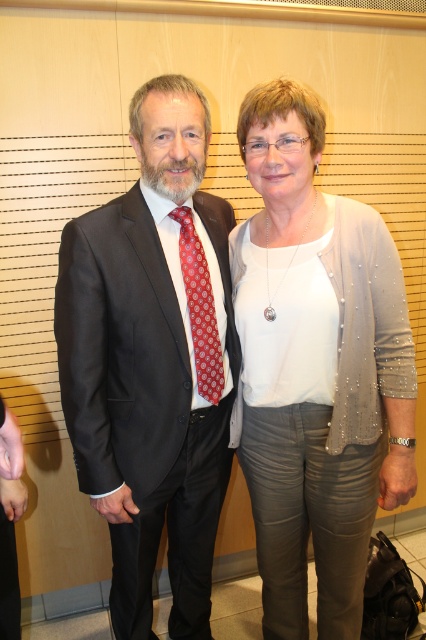
Based on the scene description, can you identify the object corresponding to the coordinates point [152,362]?

The coordinates point [152,362] correspond to the matte black suit at center.

You are an interior designer analyzing the image. You need to place a decorative item exactly at the position of the pearl gray cardigan at center. What are the coordinates where you should place the item?

The pearl gray cardigan at center is located at coordinates point (x=316, y=369), so you should place the decorative item there.